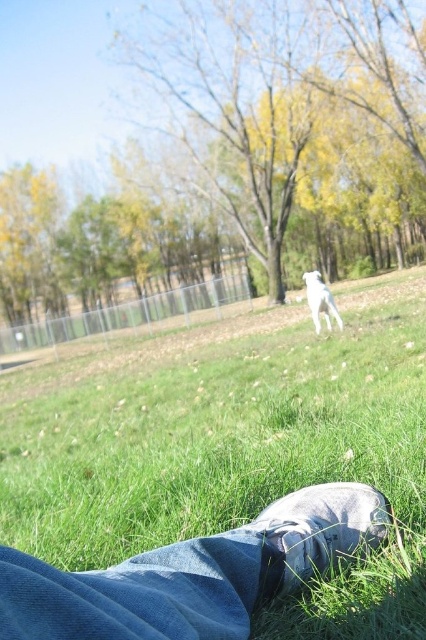
Question: Is green grassy field at center smaller than denim at lower center?

Choices:
 (A) yes
 (B) no

Answer: (B)

Question: Which object is positioned farthest from the white fur dog at center?

Choices:
 (A) denim at lower center
 (B) denim jeans at lower center
 (C) green grassy field at center

Answer: (B)

Question: Is green grassy field at center to the left of denim at lower center from the viewer's perspective?

Choices:
 (A) no
 (B) yes

Answer: (B)

Question: Which point is closer to the camera taking this photo?

Choices:
 (A) (307, 275)
 (B) (294, 545)
 (C) (304, 509)

Answer: (B)

Question: Is green grassy field at center to the left of denim jeans at lower center from the viewer's perspective?

Choices:
 (A) yes
 (B) no

Answer: (A)

Question: Estimate the real-world distances between objects in this image. Which object is farther from the denim at lower center?

Choices:
 (A) green grassy field at center
 (B) white fur dog at center
 (C) denim jeans at lower center

Answer: (B)